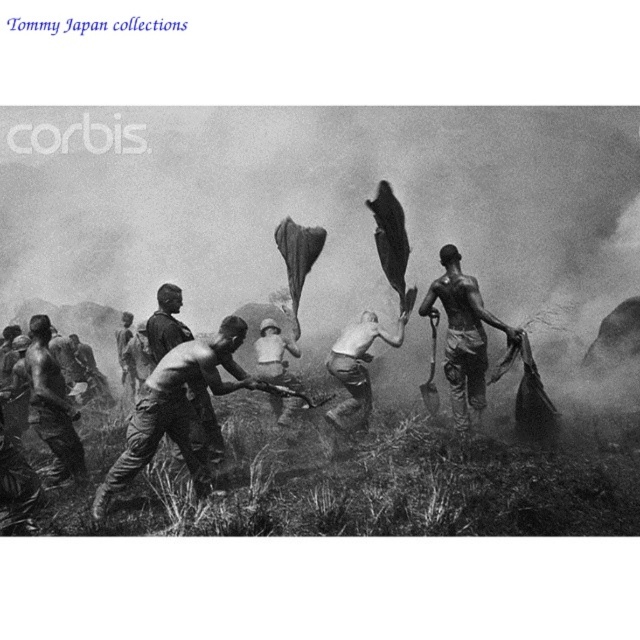
Question: From the image, what is the correct spatial relationship of shiny metallic shovel at right in relation to dirty skin man at left?

Choices:
 (A) above
 (B) below

Answer: (A)

Question: Which of these objects is positioned closest to the shiny metal shovel at center?

Choices:
 (A) shiny metallic helmet at center
 (B) dirty skin man at left

Answer: (B)

Question: Among these objects, which one is nearest to the camera?

Choices:
 (A) shiny metallic helmet at center
 (B) shiny metallic shovel at right
 (C) shiny metal shovel at center

Answer: (C)

Question: Does shiny metal shovel at center appear on the right side of shiny metallic helmet at center?

Choices:
 (A) yes
 (B) no

Answer: (B)

Question: Does dirty skin man at left have a smaller size compared to shiny metallic helmet at center?

Choices:
 (A) yes
 (B) no

Answer: (A)

Question: Which point is farther from the camera taking this photo?

Choices:
 (A) (456, 422)
 (B) (410, 300)
 (C) (227, 326)

Answer: (B)